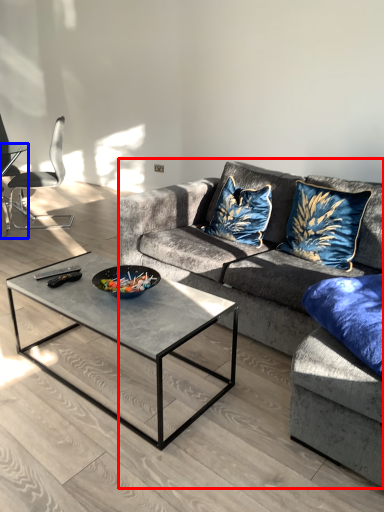
Question: Which point is closer to the camera, studio couch (highlighted by a red box) or coffee table (highlighted by a blue box)?

Choices:
 (A) studio couch
 (B) coffee table

Answer: (A)